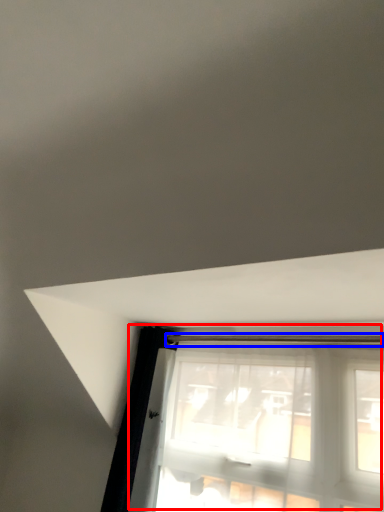
Question: Among these objects, which one is farthest to the camera, window (highlighted by a red box) or beam (highlighted by a blue box)?

Choices:
 (A) window
 (B) beam

Answer: (B)